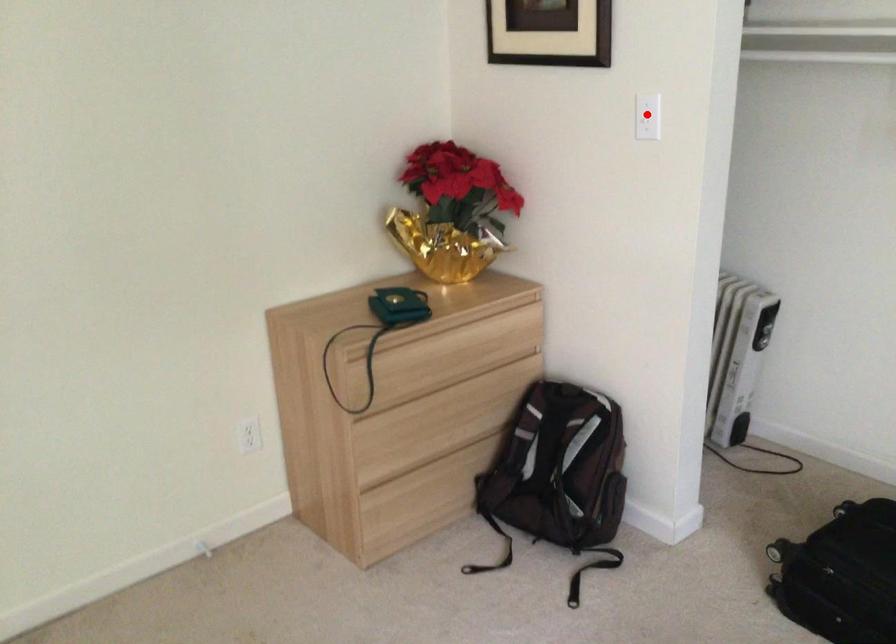
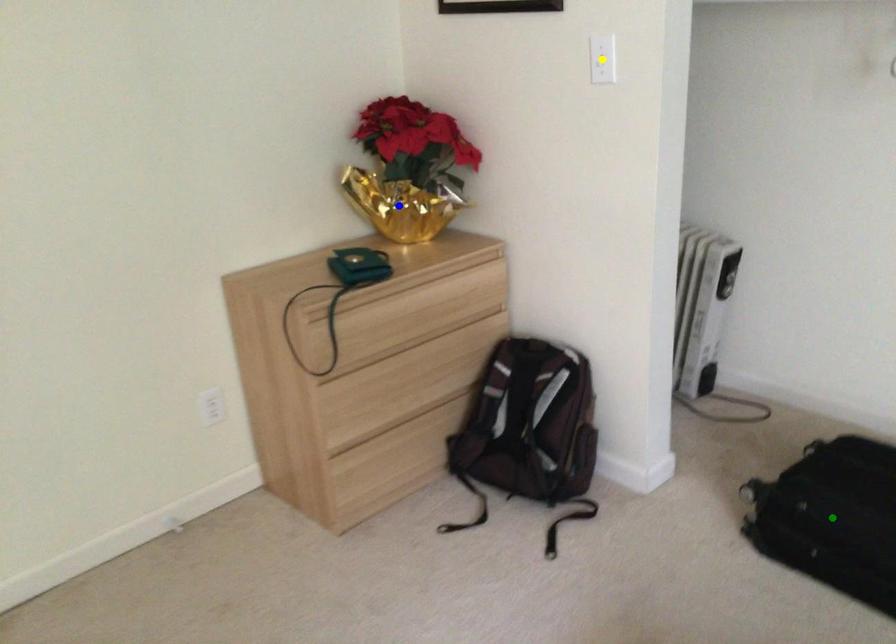
Question: I am providing you with two images of the same scene from different viewpoints. A red point is marked on the first image. You are given multiple points on the second image. Can you choose the point in image 2 that corresponds to the point in image 1?

Choices:
 (A) blue point
 (B) green point
 (C) yellow point

Answer: (C)